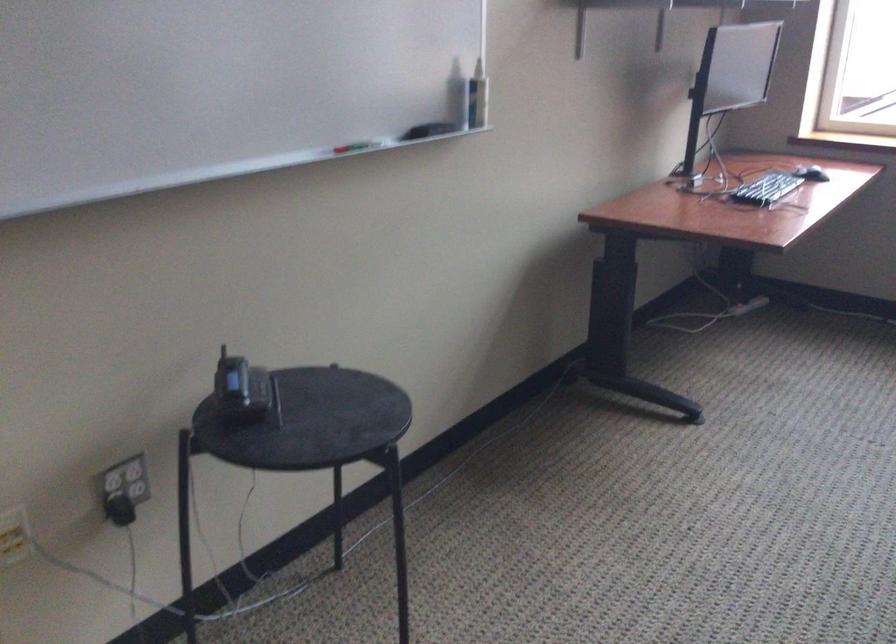
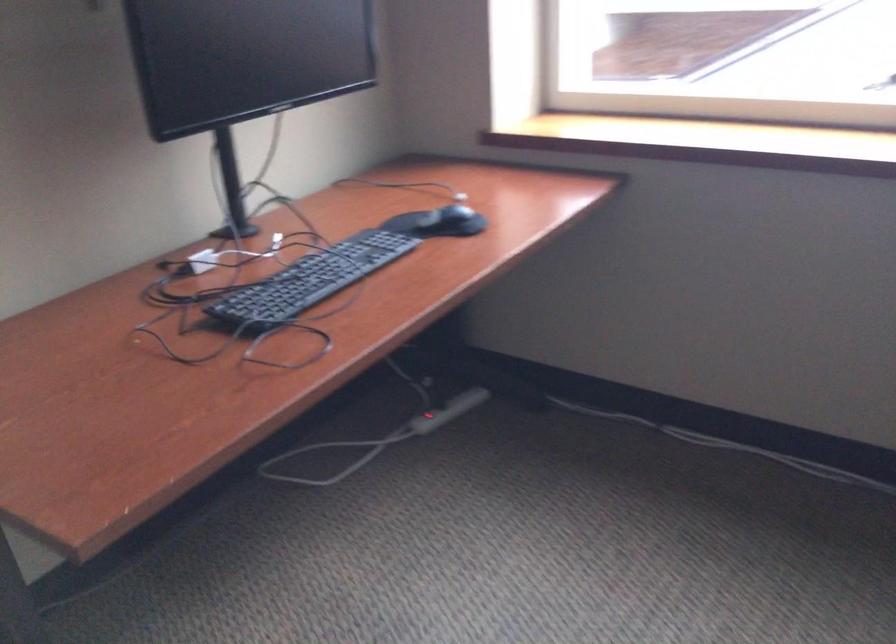
Where in the second image is the point corresponding to (725,304) from the first image?

(378, 439)